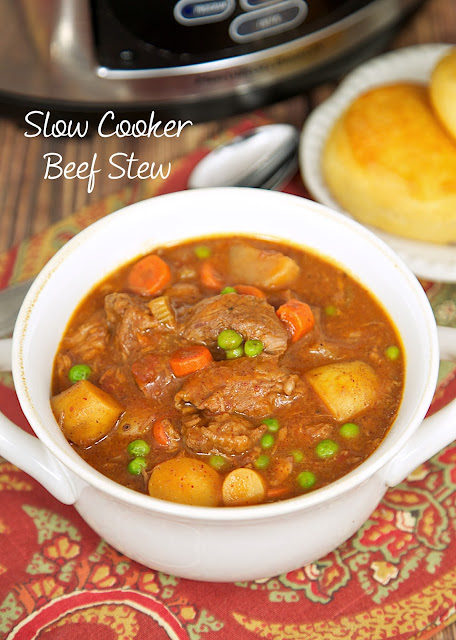
Locate an element on the screen. The width and height of the screenshot is (456, 640). slow cooker is located at coordinates (34, 58).